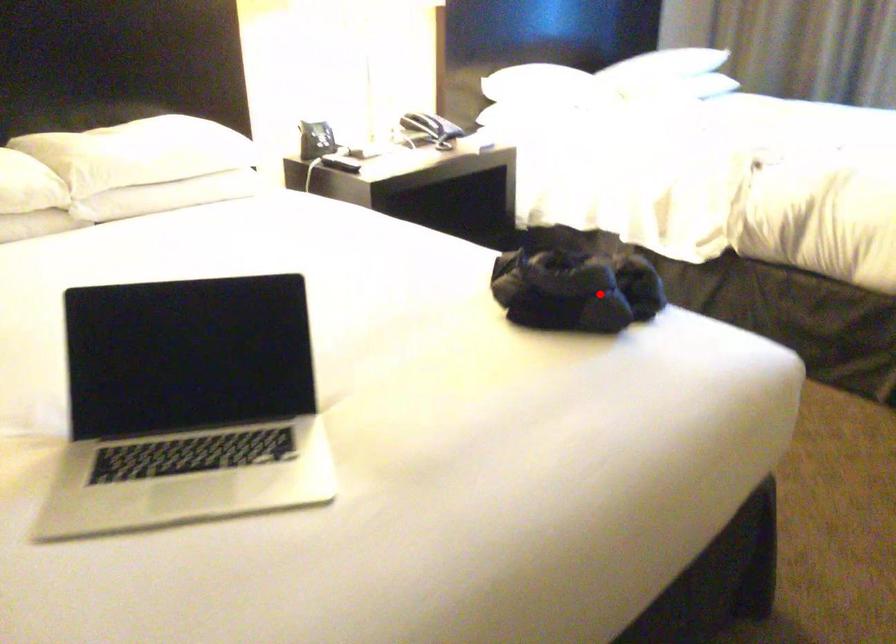
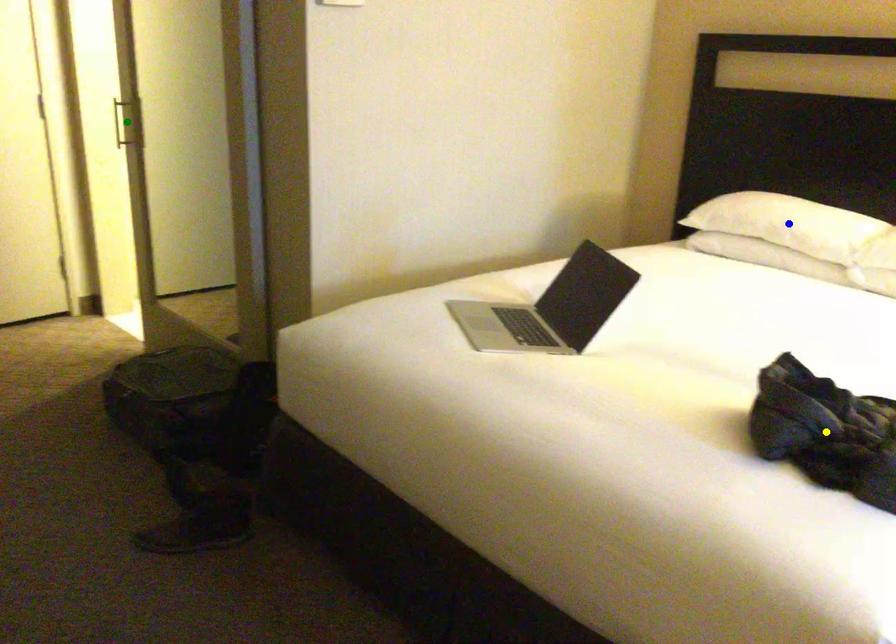
Question: I am providing you with two images of the same scene from different viewpoints. A red point is marked on the first image. You are given multiple points on the second image. Can you choose the point in image 2 that corresponds to the point in image 1?

Choices:
 (A) green point
 (B) yellow point
 (C) blue point

Answer: (B)